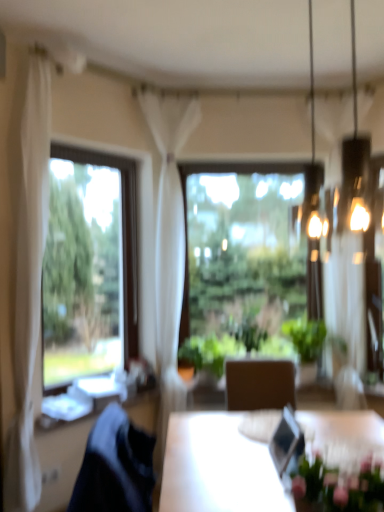
What do you see at coordinates (240, 259) in the screenshot?
I see `transparent glass window at center, marked as the first window in a right-to-left arrangement` at bounding box center [240, 259].

Identify the location of pink matte floral arrangement at lower right. (338, 487).

The width and height of the screenshot is (384, 512). What do you see at coordinates (312, 81) in the screenshot?
I see `metallic glass chandelier at upper right` at bounding box center [312, 81].

At what (x,y) coordinates should I click in order to perform the action: click on clear glass window at left, which is the first window from left to right. Please return your answer as a coordinate pair (x, y). Looking at the image, I should click on (89, 266).

Identify the location of transparent glass window at center, which appears as the 2th window when viewed from the left. click(x=240, y=259).

Is metallic glass chandelier at upper right wider than white sheer curtain at left, placed as the first curtain when sorted from front to back?

In fact, metallic glass chandelier at upper right might be narrower than white sheer curtain at left, placed as the first curtain when sorted from front to back.

Considering the relative sizes of metallic glass chandelier at upper right and white sheer curtain at left, acting as the 1th curtain starting from the left, in the image provided, is metallic glass chandelier at upper right smaller than white sheer curtain at left, acting as the 1th curtain starting from the left,?

Yes, metallic glass chandelier at upper right is smaller than white sheer curtain at left, acting as the 1th curtain starting from the left.

Could you tell me if metallic glass chandelier at upper right is turned towards white sheer curtain at left, the 2th curtain when ordered from back to front?

No, metallic glass chandelier at upper right is not turned towards white sheer curtain at left, the 2th curtain when ordered from back to front.

Measure the distance between metallic glass chandelier at upper right and white sheer curtain at left, acting as the 1th curtain starting from the left.

6.51 feet.

From a real-world perspective, does pink matte floral arrangement at lower right sit lower than white sheer curtain at left, the 2th curtain when ordered from back to front?

Yes, from a real-world perspective, pink matte floral arrangement at lower right is under white sheer curtain at left, the 2th curtain when ordered from back to front.

Which point is more distant from viewer, (321, 469) or (31, 123)?

Positioned behind is point (31, 123).

Is pink matte floral arrangement at lower right taller than white sheer curtain at left, which is the second curtain from right to left?

No.

How many degrees apart are the facing directions of pink matte floral arrangement at lower right and white sheer curtain at left, which is the second curtain from right to left?

The facing directions of pink matte floral arrangement at lower right and white sheer curtain at left, which is the second curtain from right to left, are 136 degrees apart.

How distant is transparent glass window at center, the 2th window viewed from the front, from white sheer curtain at center, marked as the 2th curtain in a front-to-back arrangement?

They are 23.31 inches apart.

From the image's perspective, is transparent glass window at center, marked as the first window in a right-to-left arrangement, located above white sheer curtain at center, the first curtain viewed from the right?

No, from the image's perspective, transparent glass window at center, marked as the first window in a right-to-left arrangement, is not on top of white sheer curtain at center, the first curtain viewed from the right.

From a real-world perspective, is transparent glass window at center, the 2th window viewed from the front, physically above white sheer curtain at center, the first curtain viewed from the right?

No.

You are a GUI agent. You are given a task and a screenshot of the screen. Output one action in this format:
    pyautogui.click(x=<x>, y=<y>)
    Task: Click on the window that appears on the right of white sheer curtain at center, marked as the 2th curtain in a front-to-back arrangement
    
    Given the screenshot: What is the action you would take?
    pyautogui.click(x=240, y=259)

Considering the sizes of objects white sheer curtain at left, acting as the 1th curtain starting from the left, and clear glass window at left, the 2th window in the right-to-left sequence, in the image provided, who is shorter, white sheer curtain at left, acting as the 1th curtain starting from the left, or clear glass window at left, the 2th window in the right-to-left sequence,?

Standing shorter between the two is clear glass window at left, the 2th window in the right-to-left sequence.

How far apart are white sheer curtain at left, the 2th curtain when ordered from back to front, and clear glass window at left, the 2th window in the right-to-left sequence?

26.29 inches.

Between point (44, 150) and point (64, 240), which one is positioned behind?

Point (64, 240)

Is white sheer curtain at left, placed as the first curtain when sorted from front to back, aimed at clear glass window at left, the 2th window in the right-to-left sequence?

No, white sheer curtain at left, placed as the first curtain when sorted from front to back, is not aimed at clear glass window at left, the 2th window in the right-to-left sequence.

Can you confirm if clear glass window at left, the 2th window positioned from the back, is shorter than pink matte floral arrangement at lower right?

In fact, clear glass window at left, the 2th window positioned from the back, may be taller than pink matte floral arrangement at lower right.

Considering the positions of objects clear glass window at left, which is the first window from left to right, and pink matte floral arrangement at lower right in the image provided, who is in front, clear glass window at left, which is the first window from left to right, or pink matte floral arrangement at lower right?

pink matte floral arrangement at lower right is in front.

Which point is more forward, (x=51, y=240) or (x=325, y=466)?

The point (x=325, y=466) is closer.

From the image's perspective, is clear glass window at left, the 1th window viewed from the front, located above pink matte floral arrangement at lower right?

Yes, from the image's perspective, clear glass window at left, the 1th window viewed from the front, is on top of pink matte floral arrangement at lower right.

Between transparent glass window at center, which appears as the 2th window when viewed from the left, and pink matte floral arrangement at lower right, which one is positioned behind?

transparent glass window at center, which appears as the 2th window when viewed from the left, is more distant.

Is transparent glass window at center, the 2th window viewed from the front, beside pink matte floral arrangement at lower right?

transparent glass window at center, the 2th window viewed from the front, is not next to pink matte floral arrangement at lower right, and they're not touching.

Who is shorter, transparent glass window at center, placed as the 1th window when sorted from back to front, or pink matte floral arrangement at lower right?

With less height is pink matte floral arrangement at lower right.

From a real-world perspective, is white sheer curtain at center, marked as the 2th curtain in a front-to-back arrangement, physically located above or below white sheer curtain at left, the 2th curtain when ordered from back to front?

Clearly, from a real-world perspective, white sheer curtain at center, marked as the 2th curtain in a front-to-back arrangement, is above white sheer curtain at left, the 2th curtain when ordered from back to front.

How much distance is there between white sheer curtain at center, the first curtain viewed from the right, and white sheer curtain at left, placed as the first curtain when sorted from front to back?

35.95 inches.

Where is `curtain to the right of white sheer curtain at left, which is the second curtain from right to left`? This screenshot has height=512, width=384. curtain to the right of white sheer curtain at left, which is the second curtain from right to left is located at coordinates coord(169,240).

Considering the positions of objects white sheer curtain at center, the second curtain in the left-to-right sequence, and white sheer curtain at left, placed as the first curtain when sorted from front to back, in the image provided, who is more to the right, white sheer curtain at center, the second curtain in the left-to-right sequence, or white sheer curtain at left, placed as the first curtain when sorted from front to back,?

From the viewer's perspective, white sheer curtain at center, the second curtain in the left-to-right sequence, appears more on the right side.

From a real-world perspective, which curtain is the 2nd one underneath the metallic glass chandelier at upper right? Please provide its 2D coordinates.

[(27, 270)]

Where is `curtain that is the 1st one when counting backward from the pink matte floral arrangement at lower right`? curtain that is the 1st one when counting backward from the pink matte floral arrangement at lower right is located at coordinates (27, 270).

Considering their positions, is pink matte floral arrangement at lower right positioned further to clear glass window at left, the 2th window in the right-to-left sequence, than transparent glass window at center, placed as the 1th window when sorted from back to front?

Among the two, pink matte floral arrangement at lower right is located further to clear glass window at left, the 2th window in the right-to-left sequence.

When comparing their distances from metallic glass chandelier at upper right, does white sheer curtain at left, the 2th curtain when ordered from back to front, or white sheer curtain at center, the first curtain viewed from the right, seem closer?

The object closer to metallic glass chandelier at upper right is white sheer curtain at center, the first curtain viewed from the right.

In the scene shown: Considering their positions, is metallic glass chandelier at upper right positioned closer to clear glass window at left, the 1th window viewed from the front, than white sheer curtain at left, the 2th curtain when ordered from back to front?

white sheer curtain at left, the 2th curtain when ordered from back to front, is closer to clear glass window at left, the 1th window viewed from the front.

In the scene shown: Based on their spatial positions, is white sheer curtain at left, the 2th curtain when ordered from back to front, or clear glass window at left, the 2th window positioned from the back, closer to white sheer curtain at center, the second curtain in the left-to-right sequence?

clear glass window at left, the 2th window positioned from the back, is closer to white sheer curtain at center, the second curtain in the left-to-right sequence.

From the image, which object appears to be nearer to transparent glass window at center, which appears as the 2th window when viewed from the left, pink matte floral arrangement at lower right or clear glass window at left, the 1th window viewed from the front?

clear glass window at left, the 1th window viewed from the front.

Considering their positions, is clear glass window at left, the 2th window positioned from the back, positioned further to transparent glass window at center, the 2th window viewed from the front, than white sheer curtain at left, placed as the first curtain when sorted from front to back?

white sheer curtain at left, placed as the first curtain when sorted from front to back, is positioned further to the anchor transparent glass window at center, the 2th window viewed from the front.

Considering their positions, is white sheer curtain at left, which is the second curtain from right to left, positioned closer to clear glass window at left, which is the first window from left to right, than transparent glass window at center, marked as the first window in a right-to-left arrangement?

white sheer curtain at left, which is the second curtain from right to left, lies closer to clear glass window at left, which is the first window from left to right, than the other object.

When comparing their distances from metallic glass chandelier at upper right, does pink matte floral arrangement at lower right or clear glass window at left, the 2th window positioned from the back, seem closer?

Based on the image, clear glass window at left, the 2th window positioned from the back, appears to be nearer to metallic glass chandelier at upper right.

Where is `curtain located between pink matte floral arrangement at lower right and white sheer curtain at center, marked as the 2th curtain in a front-to-back arrangement, in the depth direction`? The width and height of the screenshot is (384, 512). curtain located between pink matte floral arrangement at lower right and white sheer curtain at center, marked as the 2th curtain in a front-to-back arrangement, in the depth direction is located at coordinates (27, 270).

Identify the location of curtain between clear glass window at left, which is the first window from left to right, and transparent glass window at center, marked as the first window in a right-to-left arrangement, in the horizontal direction. The height and width of the screenshot is (512, 384). (169, 240).

Locate an element on the screen. The height and width of the screenshot is (512, 384). window positioned between pink matte floral arrangement at lower right and white sheer curtain at center, the first curtain viewed from the right, from near to far is located at coordinates (89, 266).

The height and width of the screenshot is (512, 384). In order to click on curtain situated between white sheer curtain at left, the 2th curtain when ordered from back to front, and transparent glass window at center, marked as the first window in a right-to-left arrangement, from left to right in this screenshot , I will do `click(169, 240)`.